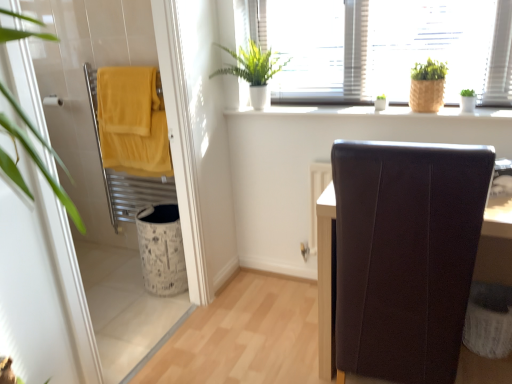
Question: Is white textured laundry basket at lower right in front of brown leather chair at right?

Choices:
 (A) yes
 (B) no

Answer: (B)

Question: Considering the relative sizes of white textured laundry basket at lower right and brown leather chair at right in the image provided, is white textured laundry basket at lower right smaller than brown leather chair at right?

Choices:
 (A) yes
 (B) no

Answer: (A)

Question: Considering the relative positions of white textured laundry basket at lower right and brown leather chair at right in the image provided, is white textured laundry basket at lower right to the right of brown leather chair at right from the viewer's perspective?

Choices:
 (A) yes
 (B) no

Answer: (A)

Question: Is white textured laundry basket at lower right oriented away from brown leather chair at right?

Choices:
 (A) no
 (B) yes

Answer: (B)

Question: Is white textured laundry basket at lower right outside of brown leather chair at right?

Choices:
 (A) yes
 (B) no

Answer: (B)

Question: In the image, is matte yellow towel at left positioned in front of or behind white textured laundry basket at lower right?

Choices:
 (A) behind
 (B) front

Answer: (A)

Question: Considering the positions of point (117, 79) and point (506, 352), is point (117, 79) closer or farther from the camera than point (506, 352)?

Choices:
 (A) closer
 (B) farther

Answer: (B)

Question: Is matte yellow towel at left wider or thinner than white textured laundry basket at lower right?

Choices:
 (A) wide
 (B) thin

Answer: (B)

Question: Would you say matte yellow towel at left is to the left or to the right of white textured laundry basket at lower right in the picture?

Choices:
 (A) right
 (B) left

Answer: (B)

Question: Is matte yellow towel at left in front of or behind green leafy plant at upper center, the first houseplant from the left, in the image?

Choices:
 (A) behind
 (B) front

Answer: (A)

Question: From a real-world perspective, is matte yellow towel at left positioned above or below green leafy plant at upper center, the 3th houseplant positioned from the right?

Choices:
 (A) above
 (B) below

Answer: (B)

Question: In terms of width, does matte yellow towel at left look wider or thinner when compared to green leafy plant at upper center, the 3th houseplant positioned from the right?

Choices:
 (A) thin
 (B) wide

Answer: (A)

Question: Considering the positions of point (143, 105) and point (287, 61), is point (143, 105) closer or farther from the camera than point (287, 61)?

Choices:
 (A) farther
 (B) closer

Answer: (A)

Question: Is point (476, 110) positioned closer to the camera than point (112, 97)?

Choices:
 (A) farther
 (B) closer

Answer: (B)

Question: In terms of width, does white ceramic window sill at upper center look wider or thinner when compared to matte yellow towel at left?

Choices:
 (A) thin
 (B) wide

Answer: (B)